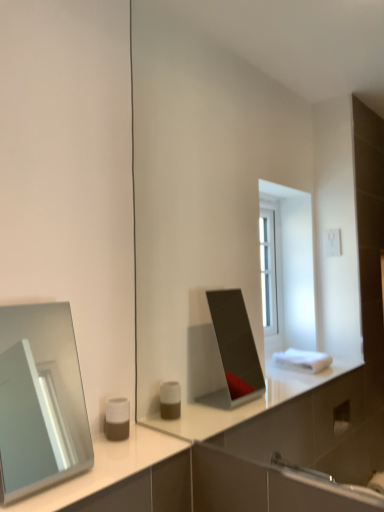
Question: Is matte white and brown cylindrical container at lower left taller or shorter than silver metallic mirror at left?

Choices:
 (A) short
 (B) tall

Answer: (A)

Question: Is matte white and brown cylindrical container at lower left wider or thinner than silver metallic mirror at left?

Choices:
 (A) thin
 (B) wide

Answer: (A)

Question: Is point (114, 400) closer or farther from the camera than point (11, 439)?

Choices:
 (A) farther
 (B) closer

Answer: (B)

Question: Considering the positions of silver metallic mirror at left and matte white and brown cylindrical container at lower left in the image, is silver metallic mirror at left bigger or smaller than matte white and brown cylindrical container at lower left?

Choices:
 (A) big
 (B) small

Answer: (A)

Question: Do you think silver metallic mirror at left is within matte white and brown cylindrical container at lower left, or outside of it?

Choices:
 (A) inside
 (B) outside

Answer: (B)

Question: In terms of height, does silver metallic mirror at left look taller or shorter compared to matte white and brown cylindrical container at lower left?

Choices:
 (A) tall
 (B) short

Answer: (A)

Question: From a real-world perspective, is silver metallic mirror at left above or below matte white and brown cylindrical container at lower left?

Choices:
 (A) above
 (B) below

Answer: (A)